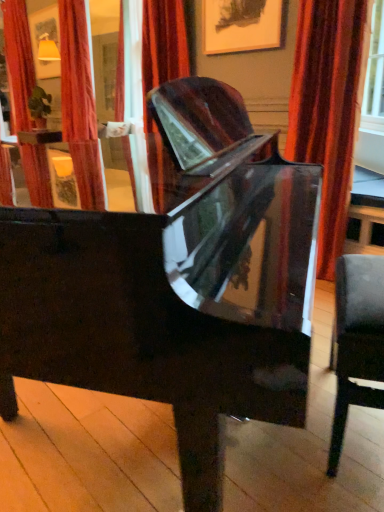
Question: Can you confirm if glossy black piano at center is thinner than leather-like black chair at right?

Choices:
 (A) yes
 (B) no

Answer: (B)

Question: Does glossy black piano at center have a greater height compared to leather-like black chair at right?

Choices:
 (A) no
 (B) yes

Answer: (B)

Question: Could you tell me if glossy black piano at center is turned towards leather-like black chair at right?

Choices:
 (A) yes
 (B) no

Answer: (B)

Question: Is glossy black piano at center outside of leather-like black chair at right?

Choices:
 (A) yes
 (B) no

Answer: (A)

Question: Considering the relative sizes of glossy black piano at center and leather-like black chair at right in the image provided, is glossy black piano at center shorter than leather-like black chair at right?

Choices:
 (A) yes
 (B) no

Answer: (B)

Question: Is leather-like black chair at right located within glossy black piano at center?

Choices:
 (A) yes
 (B) no

Answer: (B)

Question: Would you say velvet-like red curtain at right, which is the first curtain in bottom-to-top order, is outside leather-like black chair at right?

Choices:
 (A) yes
 (B) no

Answer: (A)

Question: Is velvet-like red curtain at right, which is the first curtain in bottom-to-top order, in front of leather-like black chair at right?

Choices:
 (A) no
 (B) yes

Answer: (A)

Question: Is velvet-like red curtain at right, which is counted as the second curtain, starting from the left, at the right side of leather-like black chair at right?

Choices:
 (A) yes
 (B) no

Answer: (A)

Question: Are velvet-like red curtain at right, acting as the 1th curtain starting from the front, and leather-like black chair at right making contact?

Choices:
 (A) yes
 (B) no

Answer: (B)

Question: From a real-world perspective, is velvet-like red curtain at right, which is the second curtain from top to bottom, below leather-like black chair at right?

Choices:
 (A) no
 (B) yes

Answer: (A)

Question: Can you confirm if velvet-like red curtain at right, the second curtain viewed from the back, is thinner than leather-like black chair at right?

Choices:
 (A) no
 (B) yes

Answer: (A)

Question: Is velvet-like red curtain at right, the second curtain viewed from the back, looking in the opposite direction of glossy black piano at center?

Choices:
 (A) yes
 (B) no

Answer: (B)